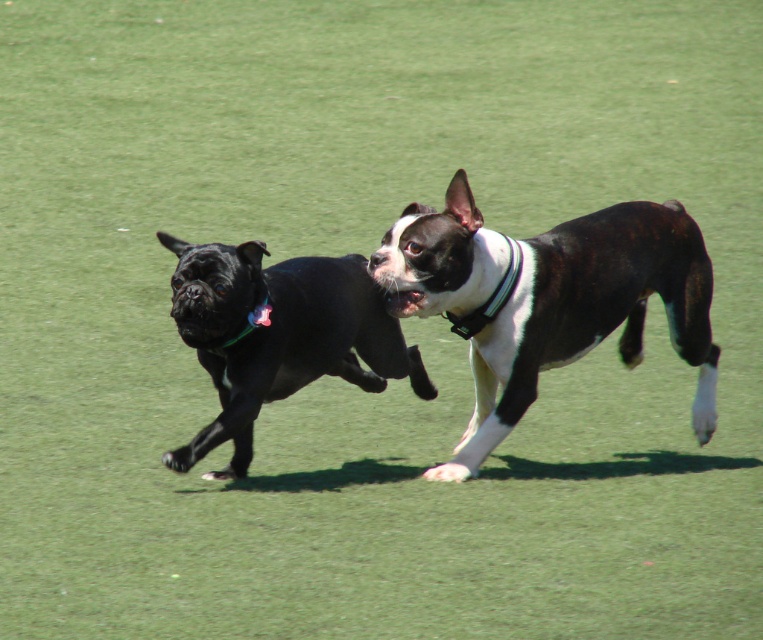
Is point (615, 276) in front of point (246, 387)?

That is False.

Can you confirm if black and white fur dog at center is positioned below shiny black dog at left?

No.

Which is behind, point (462, 272) or point (378, 388)?

The point (378, 388) is more distant.

Locate an element on the screen. black and white fur dog at center is located at coordinates (588, 314).